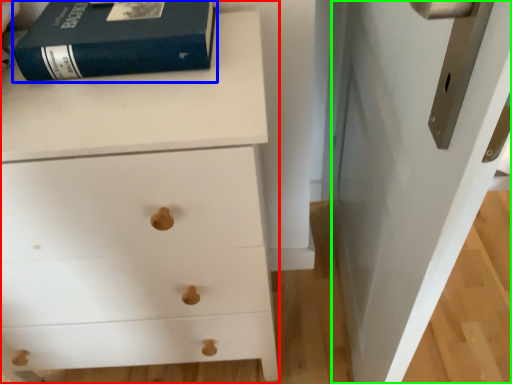
Question: Estimate the real-world distances between objects in this image. Which object is farther from chest of drawers (highlighted by a red box), paperback book (highlighted by a blue box) or door (highlighted by a green box)?

Choices:
 (A) paperback book
 (B) door

Answer: (B)